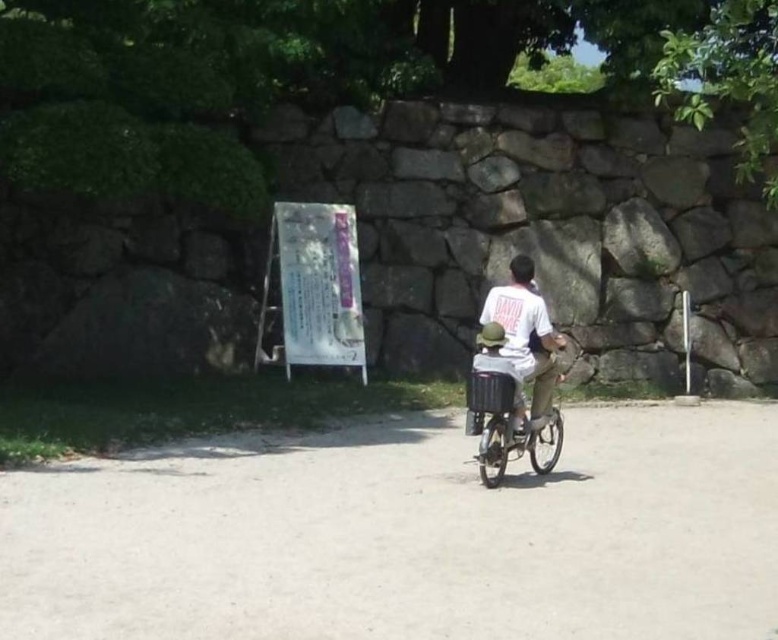
Question: Can you confirm if metallic silver tricycle at center is positioned below white cotton shirt at center?

Choices:
 (A) yes
 (B) no

Answer: (A)

Question: Which of the following is the farthest from the observer?

Choices:
 (A) (533, 406)
 (B) (556, 428)

Answer: (B)

Question: Which point is farther to the camera?

Choices:
 (A) white cotton shirt at center
 (B) metallic silver tricycle at center

Answer: (A)

Question: Is metallic silver tricycle at center bigger than white cotton shirt at center?

Choices:
 (A) yes
 (B) no

Answer: (A)

Question: Is metallic silver tricycle at center further to the viewer compared to white cotton shirt at center?

Choices:
 (A) no
 (B) yes

Answer: (A)